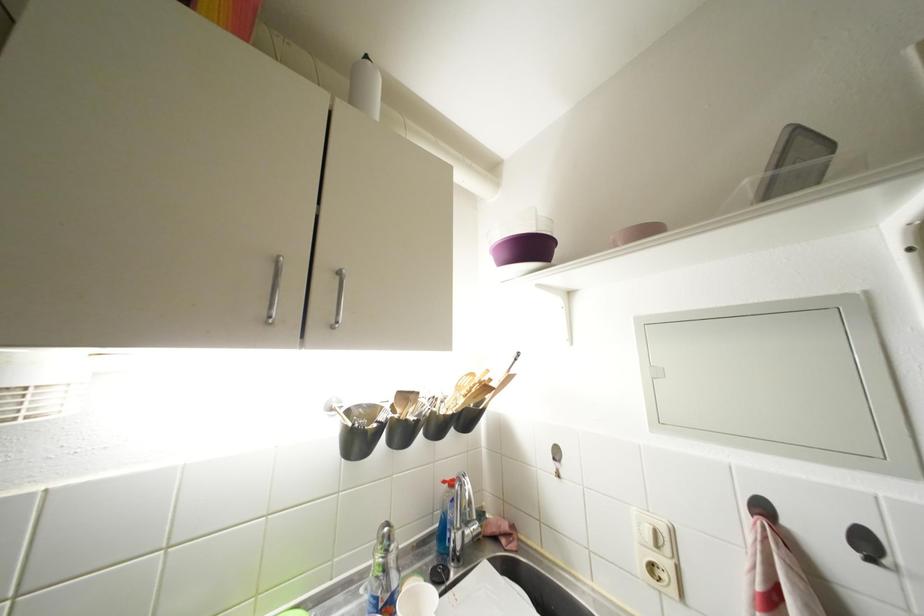
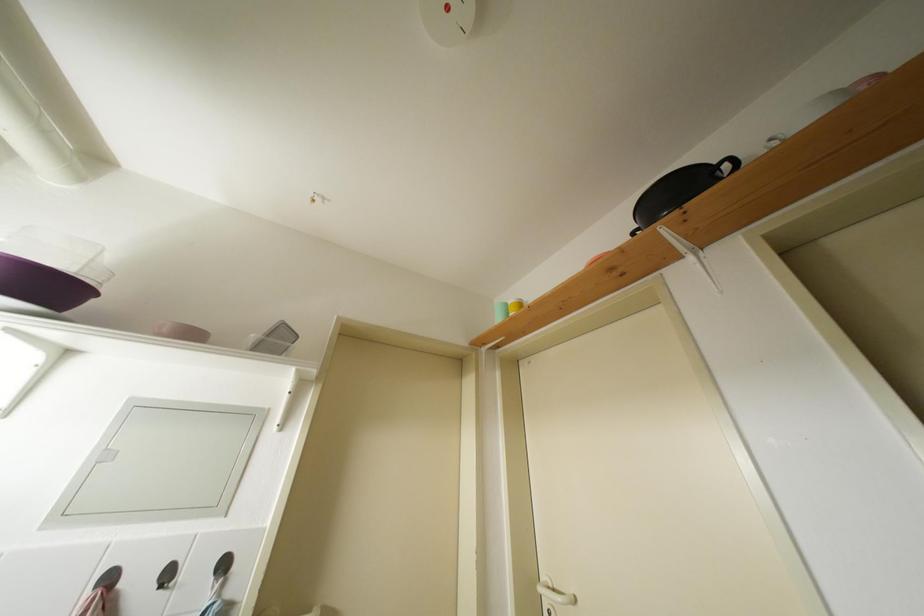
The first image is from the beginning of the video and the second image is from the end. How did the camera likely rotate when shooting the video?

The camera's rotation is toward right-up.